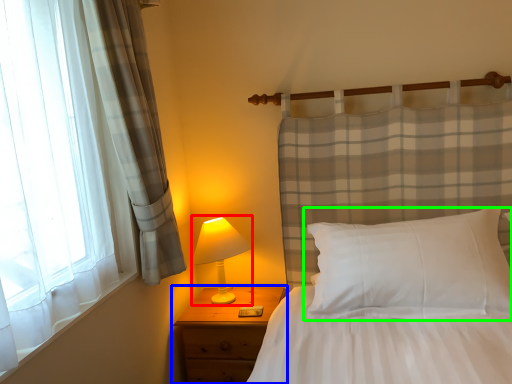
Question: Which object is the farthest from table lamp (highlighted by a red box)? Choose among these: nightstand (highlighted by a blue box) or pillow (highlighted by a green box).

Choices:
 (A) nightstand
 (B) pillow

Answer: (B)